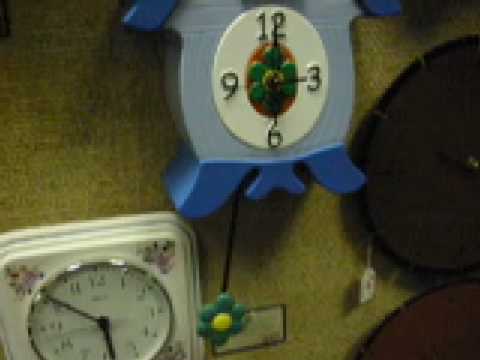
The image size is (480, 360). What are the coordinates of `clock face` in the screenshot? It's located at 122,317, 297,41.